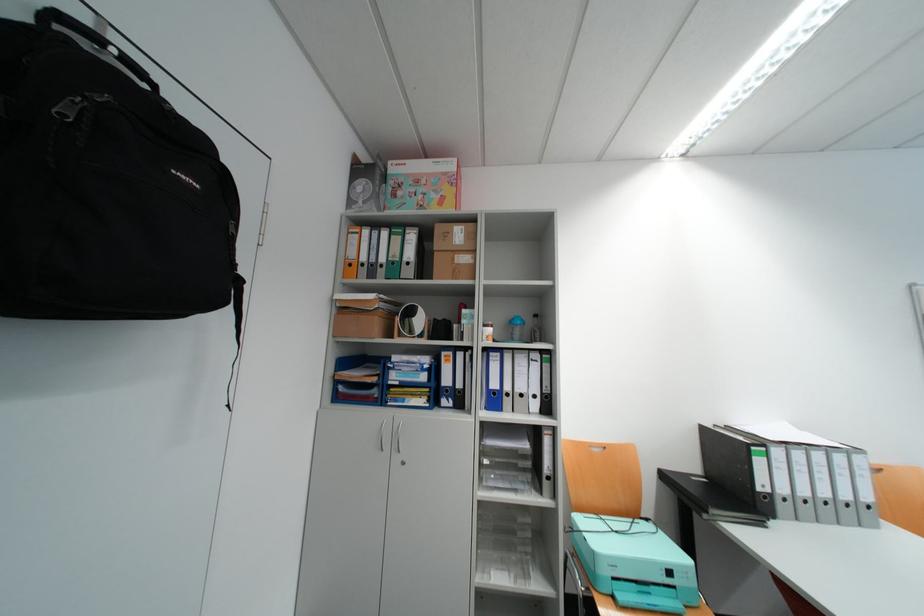
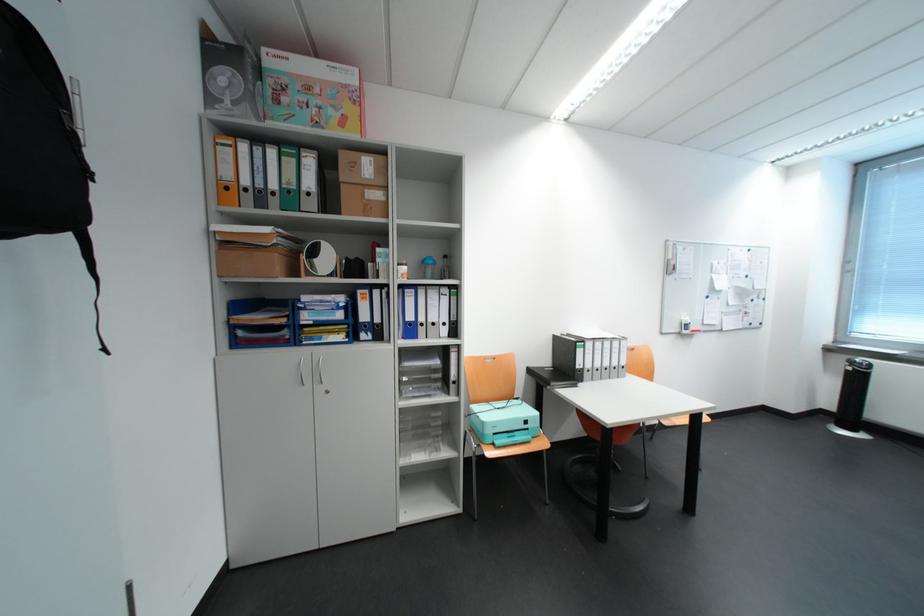
Find the pixel in the second image that matches (361,203) in the first image.

(223, 99)